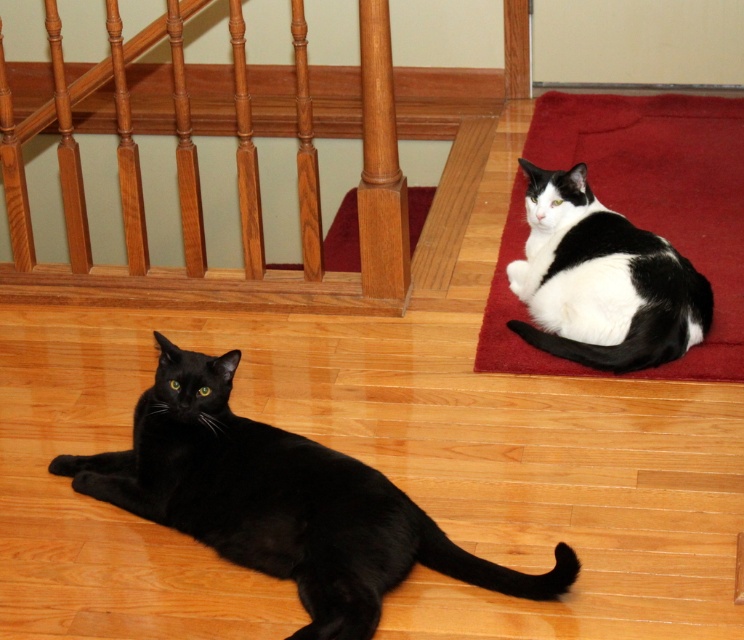
Measure the distance between wooden balustrade at upper left and camera.

wooden balustrade at upper left and camera are 8.61 feet apart from each other.

Does wooden balustrade at upper left appear on the right side of black and white fur cat at upper right?

In fact, wooden balustrade at upper left is to the left of black and white fur cat at upper right.

At what (x,y) coordinates should I click in order to perform the action: click on wooden balustrade at upper left. Please return your answer as a coordinate pair (x, y). The width and height of the screenshot is (744, 640). Looking at the image, I should click on (246, 161).

Between black glossy cat at left and black and white fur cat at upper right, which one has more height?

With more height is black and white fur cat at upper right.

Is point (359, 472) more distant than point (586, 230)?

No.

Where is `black glossy cat at left`? Image resolution: width=744 pixels, height=640 pixels. black glossy cat at left is located at coordinates (280, 500).

Locate an element on the screen. black glossy cat at left is located at coordinates (280, 500).

Is wooden balustrade at upper left to the left of black glossy cat at left from the viewer's perspective?

Indeed, wooden balustrade at upper left is positioned on the left side of black glossy cat at left.

Who is positioned more to the right, wooden balustrade at upper left or black glossy cat at left?

black glossy cat at left is more to the right.

Is point (86, 99) less distant than point (144, 417)?

No, (86, 99) is behind (144, 417).

Locate an element on the screen. wooden balustrade at upper left is located at coordinates (246, 161).